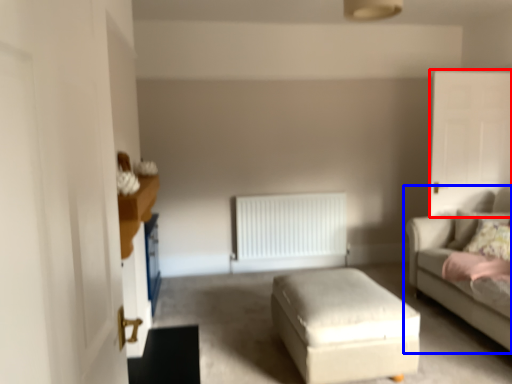
Question: Which object appears closest to the camera in this image, glass door (highlighted by a red box) or studio couch (highlighted by a blue box)?

Choices:
 (A) glass door
 (B) studio couch

Answer: (B)